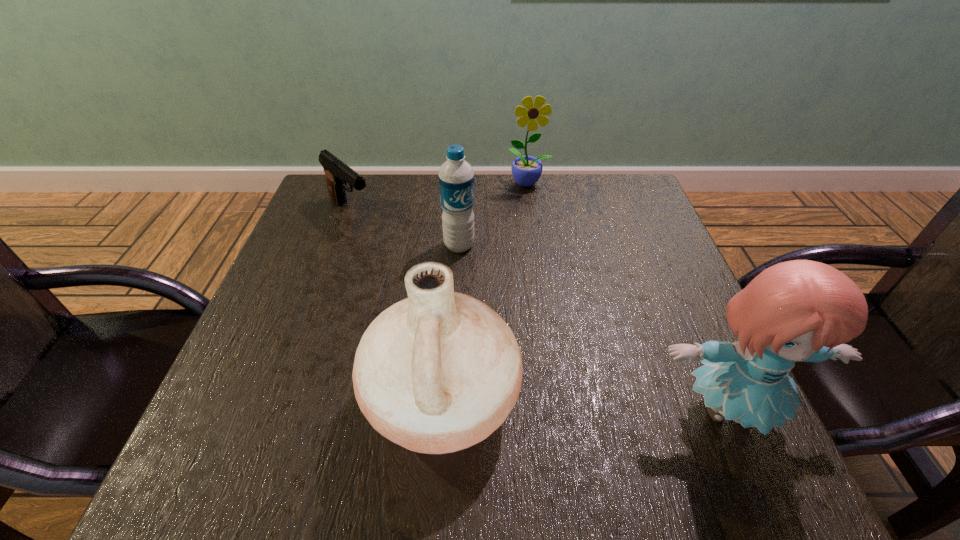
Locate an element on the screen. Image resolution: width=960 pixels, height=540 pixels. vacant point at the right edge is located at coordinates (634, 302).

In the image, there is a desktop. Where is `vacant space at the far left corner`? vacant space at the far left corner is located at coordinates (350, 214).

Image resolution: width=960 pixels, height=540 pixels. Find the location of `vacant area at the near left corner`. vacant area at the near left corner is located at coordinates pos(274,391).

Where is `free space at the far right corner of the desktop`? The width and height of the screenshot is (960, 540). free space at the far right corner of the desktop is located at coordinates (605, 208).

Image resolution: width=960 pixels, height=540 pixels. In order to click on free spot between the leftmost object and the sunflower in this screenshot , I will do `click(440, 197)`.

Image resolution: width=960 pixels, height=540 pixels. I want to click on empty space that is in between the water bottle and the fourth object from left to right, so click(494, 214).

Identify the location of free space between the third nearest object and the second object from right to left. Image resolution: width=960 pixels, height=540 pixels. (494, 214).

At what (x,y) coordinates should I click in order to perform the action: click on vacant point located between the third farthest object and the doll. Please return your answer as a coordinate pair (x, y). This screenshot has height=540, width=960. Looking at the image, I should click on (593, 328).

Where is `unoccupied position between the farthest object and the pistol`? unoccupied position between the farthest object and the pistol is located at coordinates (440, 197).

At what (x,y) coordinates should I click in order to perform the action: click on free spot between the third farthest object and the rightmost object. Please return your answer as a coordinate pair (x, y). The width and height of the screenshot is (960, 540). Looking at the image, I should click on pyautogui.click(x=593, y=328).